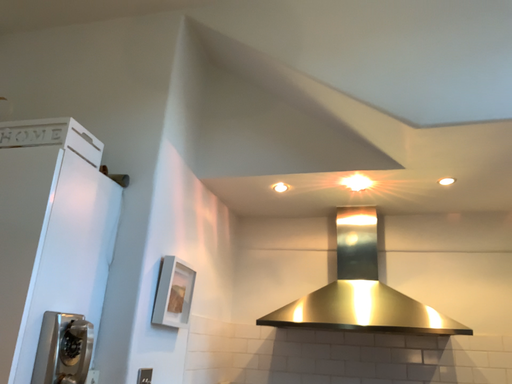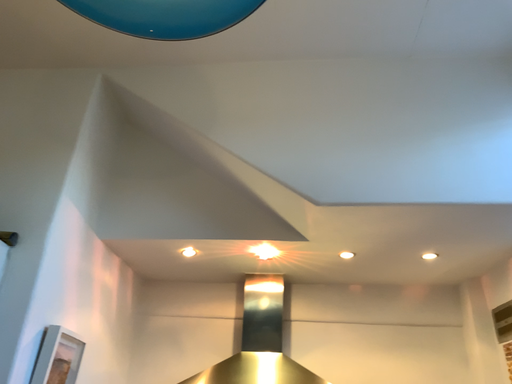
Question: How did the camera likely rotate when shooting the video?

Choices:
 (A) rotated upward
 (B) rotated downward

Answer: (A)